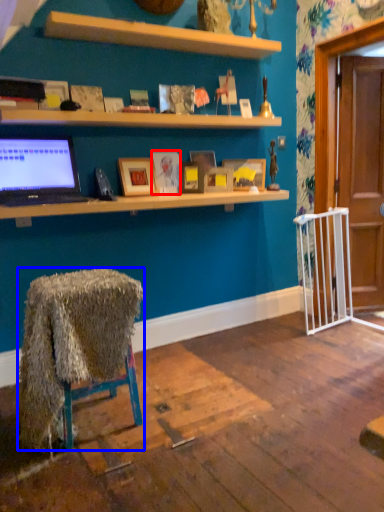
Question: Which object is closer to the camera taking this photo, picture frame (highlighted by a red box) or desk (highlighted by a blue box)?

Choices:
 (A) picture frame
 (B) desk

Answer: (B)